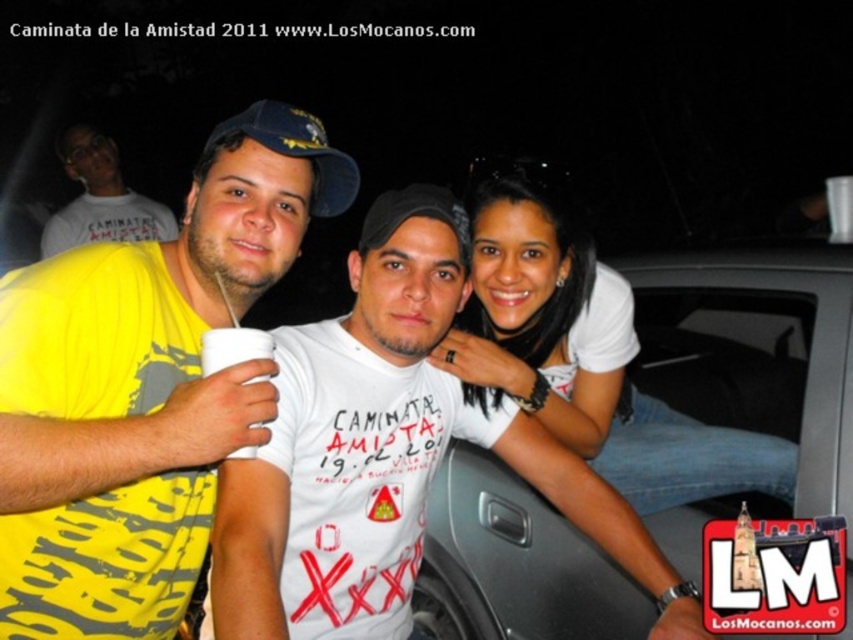
You are standing at the point with coordinates point (320, 182) and want to walk to the point with coordinates point (132, 198). Which direction should you move in?

You should move forward because point (132, 198) is behind point (320, 182), meaning it is in the direction you are facing.

You are a photographer trying to capture the text on the white T shirt of the person in the center. The text says Caminata Amistad 19.02.2011. However, there is an obstruction at point (100, 198). What object is blocking your view of the text?

The white matte t shirt at upper left is blocking the view of the text on the white T shirt of the person in the center.